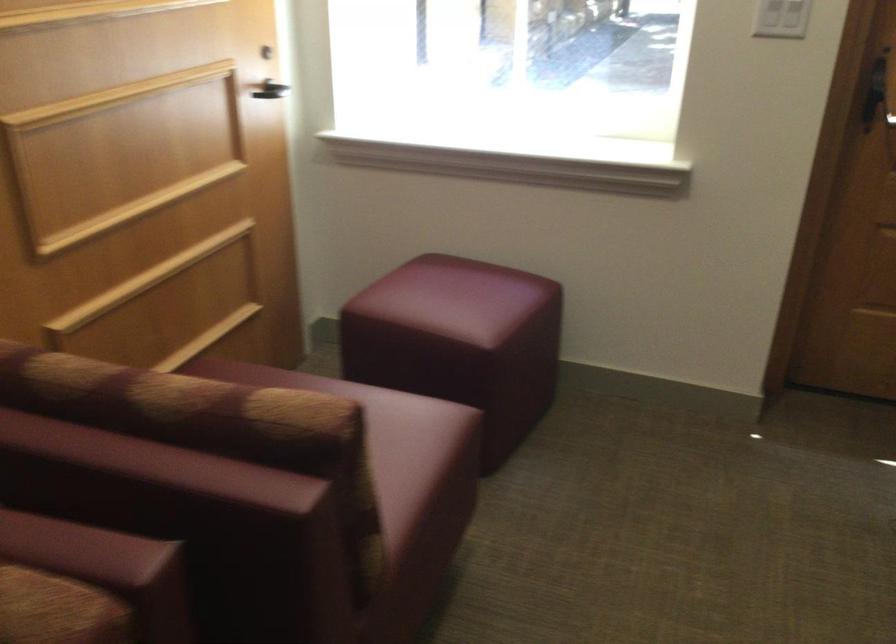
Find the location of `burgundy ottoman`. burgundy ottoman is located at coordinates (460, 342).